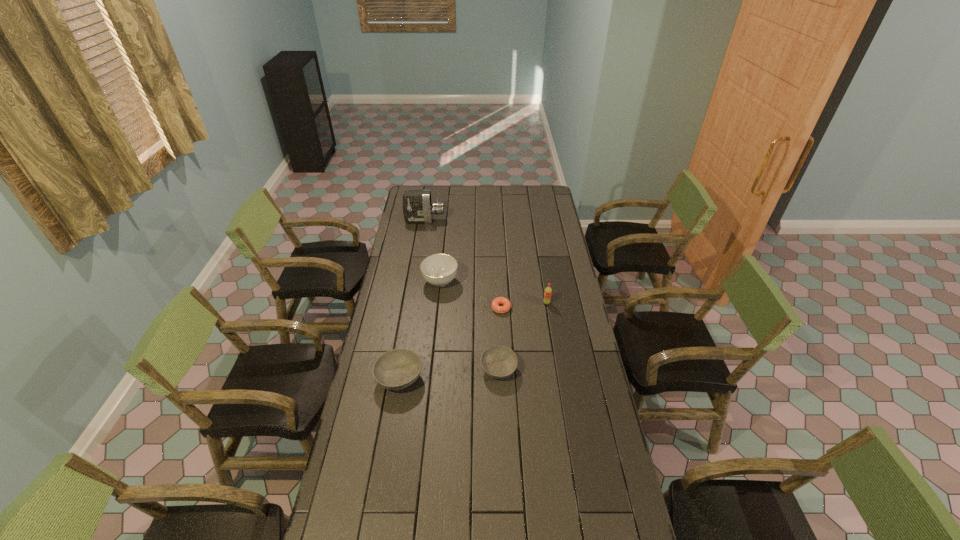
The width and height of the screenshot is (960, 540). I want to click on vacant point that satisfies the following two spatial constraints: 1. at the front of the tallest object, highlighting the lens; 2. on the right side of the shortest object, so click(x=410, y=308).

Where is `free spot that satisfies the following two spatial constraints: 1. at the front of the fourth shortest object, highlighting the lens; 2. on the left side of the camcorder`? free spot that satisfies the following two spatial constraints: 1. at the front of the fourth shortest object, highlighting the lens; 2. on the left side of the camcorder is located at coordinates (415, 281).

The width and height of the screenshot is (960, 540). Identify the location of vacant space that satisfies the following two spatial constraints: 1. at the front of the farthest object, highlighting the lens; 2. on the right side of the shortest object. click(x=410, y=308).